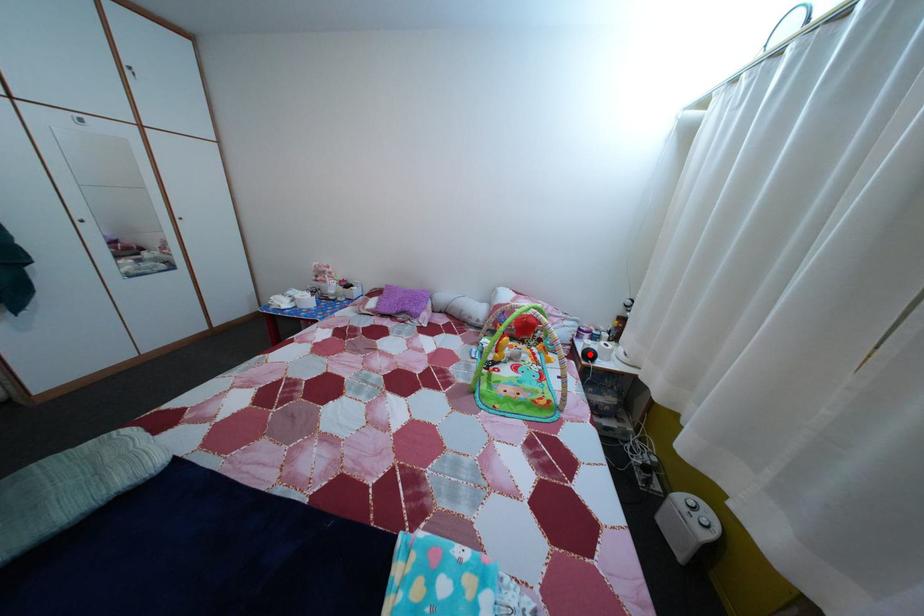
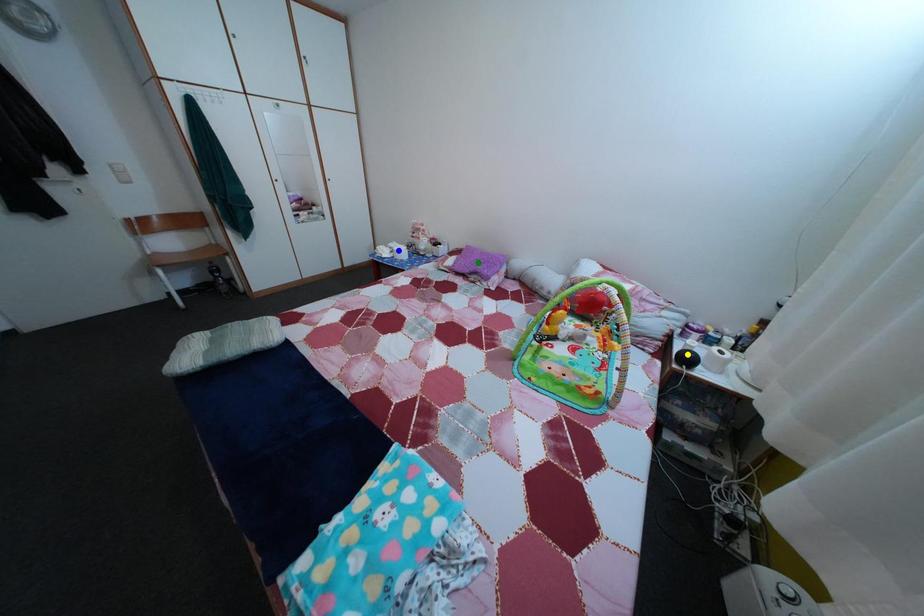
Question: I am providing you with two images of the same scene from different viewpoints. A red point is marked on the first image. You are given multiple points on the second image. Which point in image 2 is actually the same real-world point as the red point in image 1?

Choices:
 (A) yellow point
 (B) green point
 (C) blue point

Answer: (A)